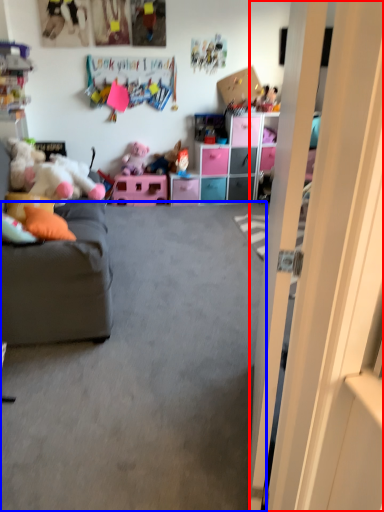
Question: Which object is further to the camera taking this photo, door (highlighted by a red box) or plain (highlighted by a blue box)?

Choices:
 (A) door
 (B) plain

Answer: (B)